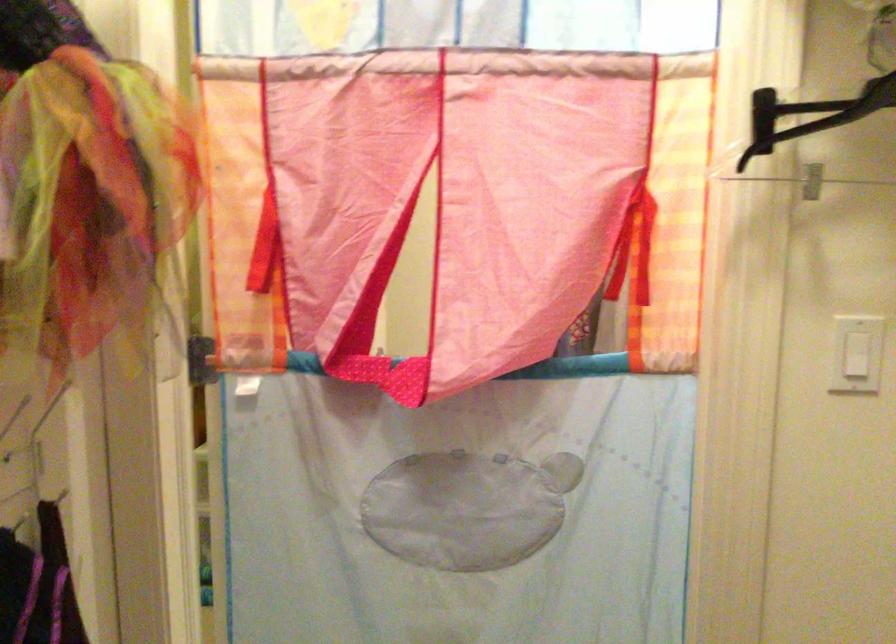
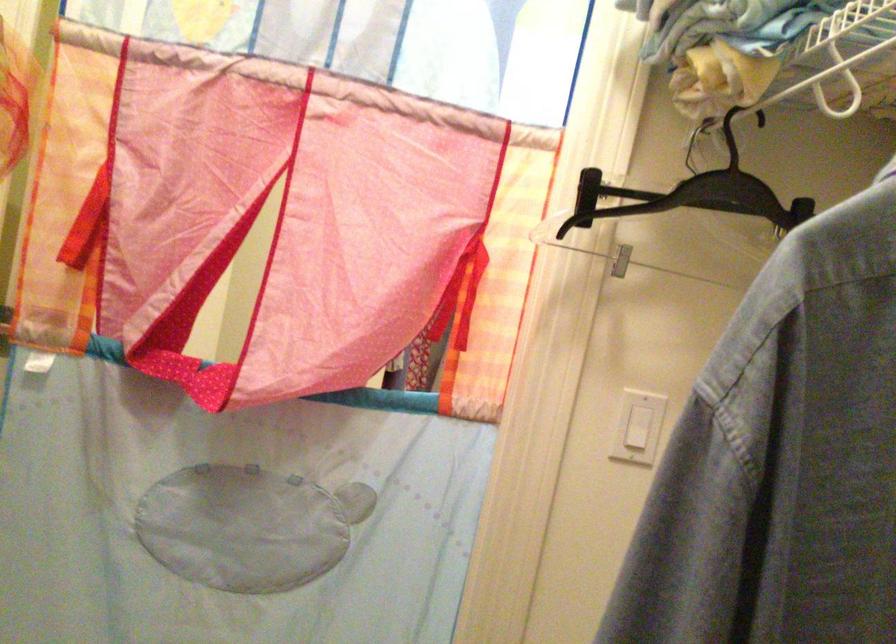
Question: I am providing you with two images of the same scene from different viewpoints. After the viewpoint changes to image2, which objects are now occluded?

Choices:
 (A) black clothes hanger
 (B) white shelf rod
 (C) hanger clip
 (D) none of these

Answer: (D)